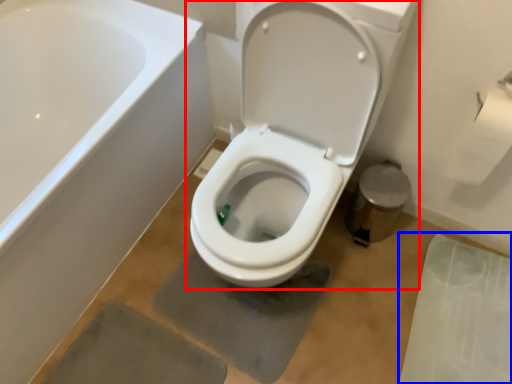
Question: Which object is closer to the camera taking this photo, toilet (highlighted by a red box) or concrete (highlighted by a blue box)?

Choices:
 (A) toilet
 (B) concrete

Answer: (A)